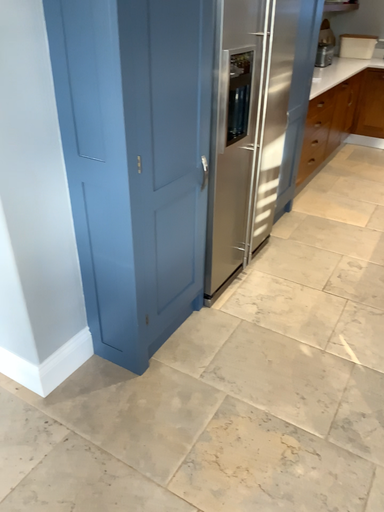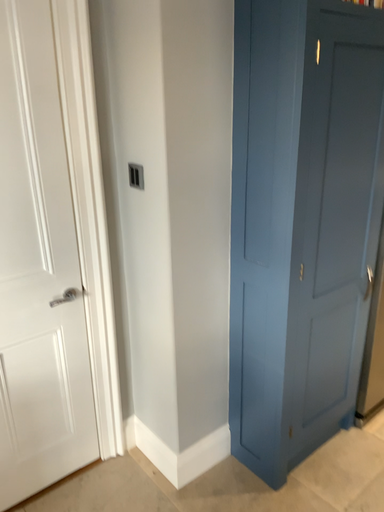
Question: Which way did the camera rotate in the video?

Choices:
 (A) rotated upward
 (B) rotated downward

Answer: (A)